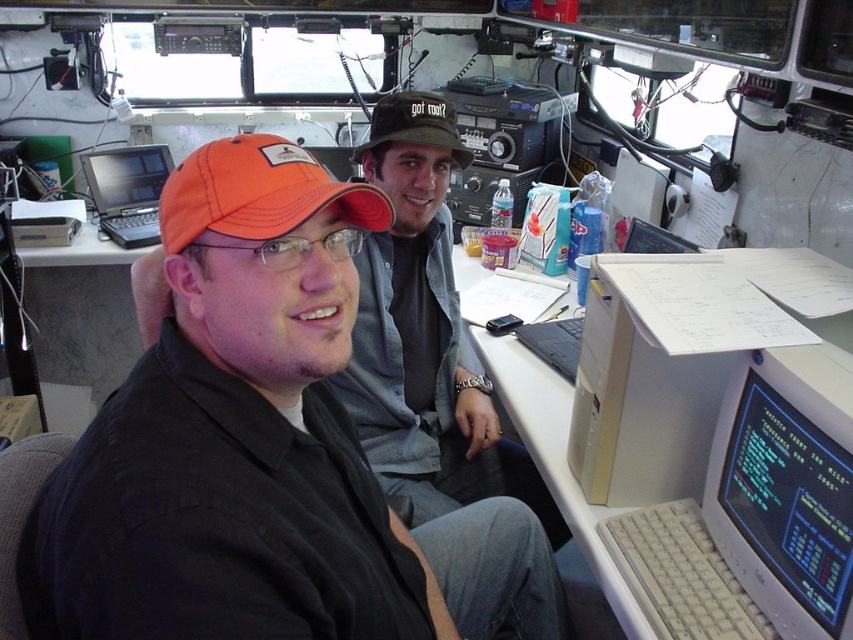
Question: From the image, what is the correct spatial relationship of orange fabric cap at center in relation to matte black laptop at left?

Choices:
 (A) below
 (B) above

Answer: (A)

Question: Is matte gray monitor at lower right behind white plastic computer desk at center?

Choices:
 (A) no
 (B) yes

Answer: (A)

Question: Does orange fabric cap at center have a larger size compared to black fabric hat at center?

Choices:
 (A) yes
 (B) no

Answer: (A)

Question: Among these points, which one is farthest from the camera?

Choices:
 (A) (262, 173)
 (B) (326, 218)
 (C) (531, 332)
 (D) (109, 164)

Answer: (D)

Question: Among these points, which one is farthest from the camera?

Choices:
 (A) (113, 237)
 (B) (636, 611)
 (C) (178, 244)

Answer: (A)

Question: Which of the following is the farthest from the observer?

Choices:
 (A) (444, 141)
 (B) (144, 448)
 (C) (618, 509)

Answer: (A)